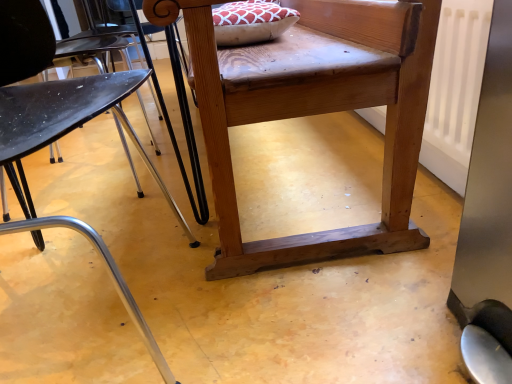
Where is `empty space that is to the right of metallic black chair at left`? This screenshot has height=384, width=512. empty space that is to the right of metallic black chair at left is located at coordinates (303, 318).